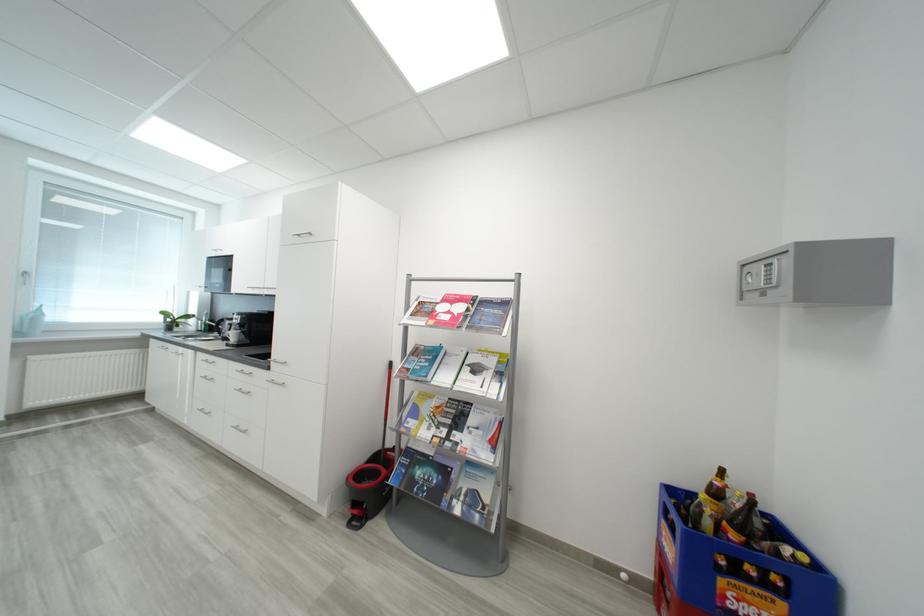
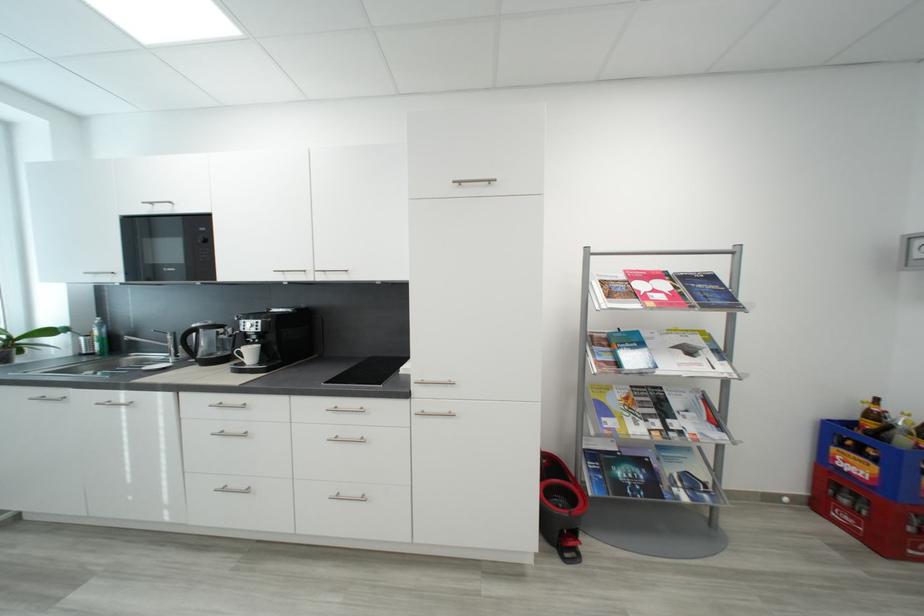
The point at (x=453, y=472) is marked in the first image. Where is the corresponding point in the second image?

(650, 464)